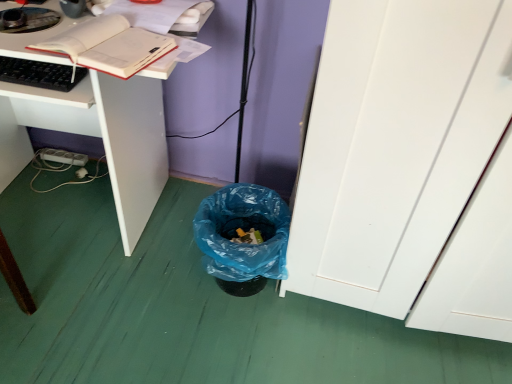
You are a GUI agent. You are given a task and a screenshot of the screen. Output one action in this format:
    pyautogui.click(x=<x>, y=<y>)
    Task: Click on the vacant area situated below white matte desk at lower left (from a real-world perspective)
    Image resolution: width=512 pixels, height=384 pixels.
    Given the screenshot: What is the action you would take?
    pyautogui.click(x=92, y=221)